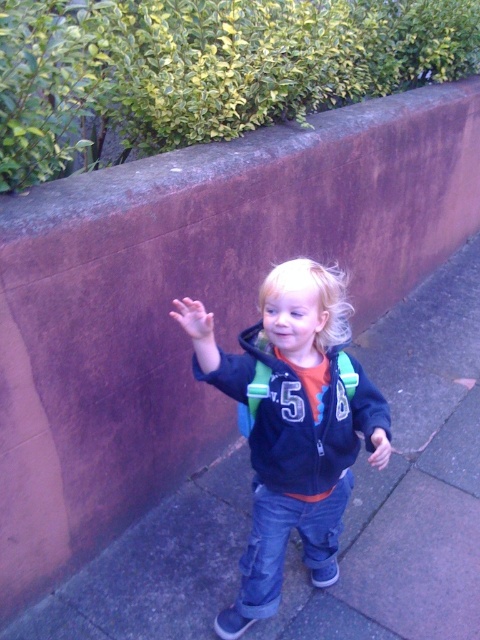
Question: Estimate the real-world distances between objects in this image. Which object is farther from the matte black jacket at center?

Choices:
 (A) gray concrete pavement at center
 (B) green leafy hedge at upper left
 (C) matte blue hoodie at center

Answer: (B)

Question: In this image, where is green leafy hedge at upper left located relative to matte blue hoodie at center?

Choices:
 (A) left
 (B) right

Answer: (B)

Question: Does gray concrete pavement at center have a larger size compared to matte blue hoodie at center?

Choices:
 (A) yes
 (B) no

Answer: (A)

Question: Estimate the real-world distances between objects in this image. Which object is closer to the matte black jacket at center?

Choices:
 (A) gray concrete pavement at center
 (B) green leafy hedge at upper left
 (C) matte blue hoodie at center

Answer: (C)

Question: Does matte blue hoodie at center appear on the right side of matte black jacket at center?

Choices:
 (A) no
 (B) yes

Answer: (A)

Question: Which point is closer to the camera?

Choices:
 (A) green leafy hedge at upper left
 (B) matte blue hoodie at center

Answer: (A)